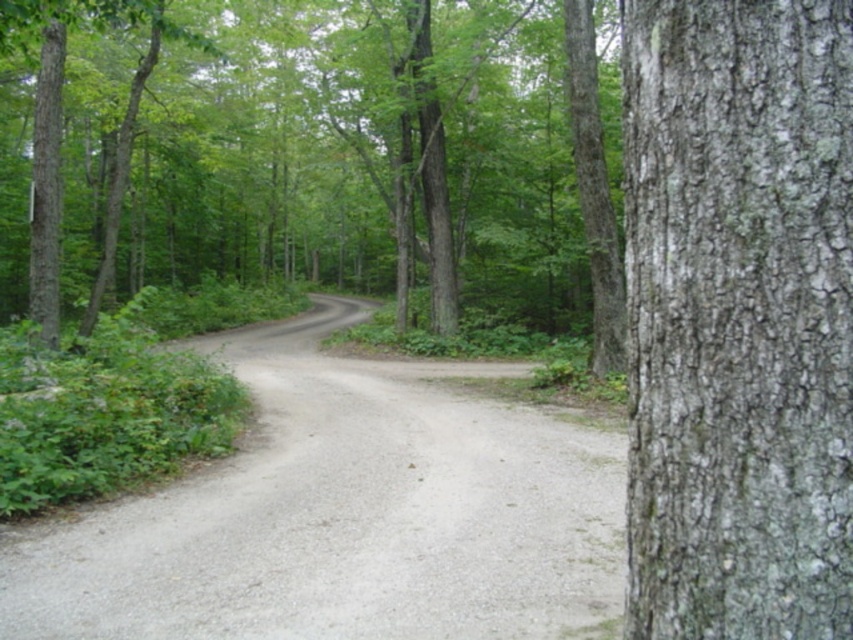
You are a hiker carrying a large backpack and need to walk along the gray gravel trail at center. There is a rough bark tree at center blocking your path. Can you walk around it without leaving the trail?

The rough bark tree at center is larger than the gray gravel trail at center, so it may block the path. To avoid the tree while staying on the trail, you might need to navigate carefully around it, but the trail width might be insufficient due to the tree size.

You are a hiker who wants to walk along the gray gravel trail at center. There is a gray rough bark at right in your path. Can you walk around it easily?

The gray rough bark at right is in front of the gray gravel trail at center, meaning it is closer to you. Since the bark is part of a tree, you can walk around it easily by stepping onto the gravel trail at center.